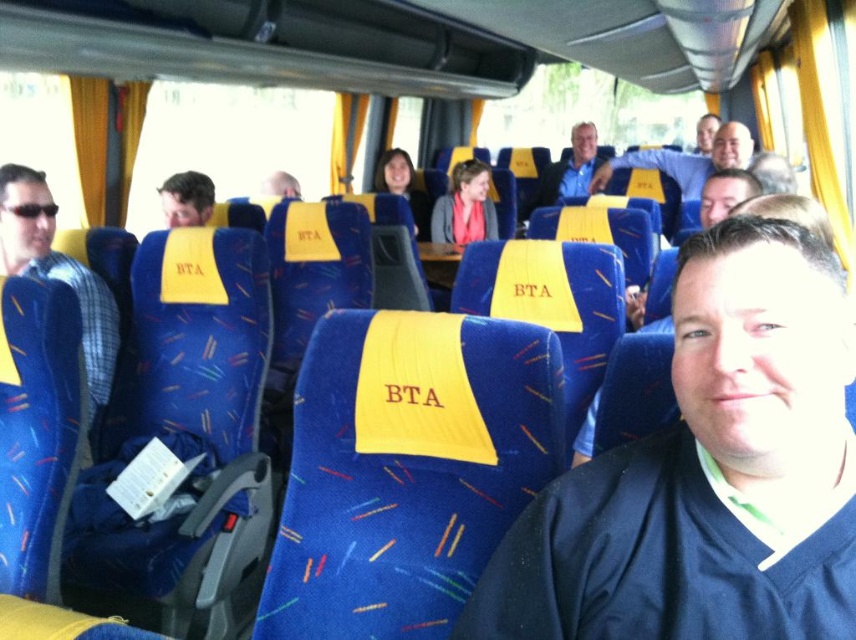
From the picture: You are a passenger on the bus and want to sit next to the person with matte black hair at upper center. Which direction should you move from the blue fabric seat at center to reach them?

The blue fabric seat at center is positioned on the right side of matte black hair at upper center. To sit next to the person with matte black hair at upper center, you should move to the left from the blue fabric seat at center.

Based on the photo, you are a passenger sitting in the bus and want to know if the matte blue shirt at center is shorter than the matte yellow seat at center. Can you confirm this?

The matte blue shirt at center has a lesser height compared to the matte yellow seat at center, so yes, the matte blue shirt at center is shorter than the matte yellow seat at center.

You are a bus passenger who wants to sit down. You see the blue fabric seat at center and the matte black hair at upper center. Which object is wider?

The blue fabric seat at center is wider than the matte black hair at upper center.